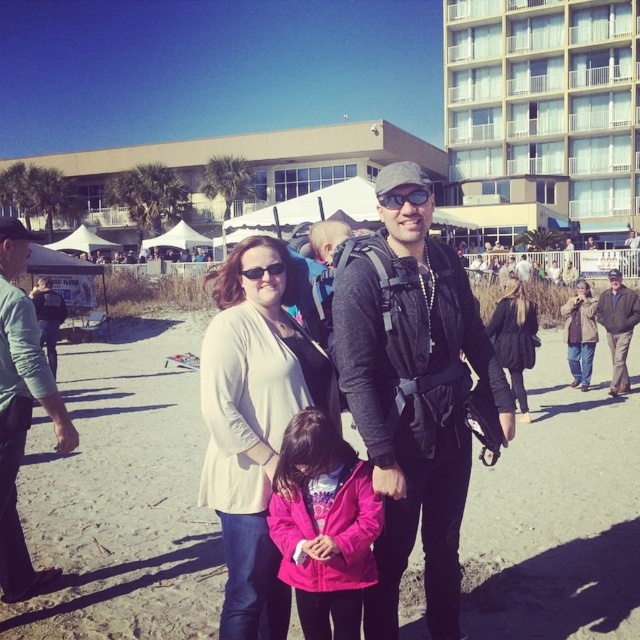
You are a photographer planning to take a group photo of the khaki cotton jacket at right and the matte black sunglasses at center. Considering their sizes, which object should you place closer to the camera to ensure both appear similar in size in the photo?

The khaki cotton jacket at right is larger in size compared to the matte black sunglasses at center. To make them appear similar in size in the photo, you should place the matte black sunglasses at center closer to the camera than the khaki cotton jacket at right.